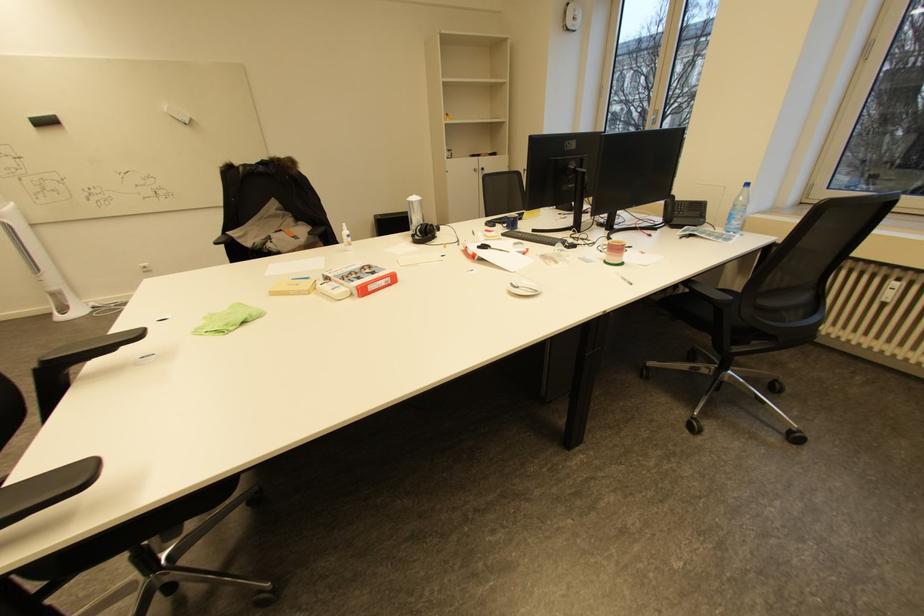
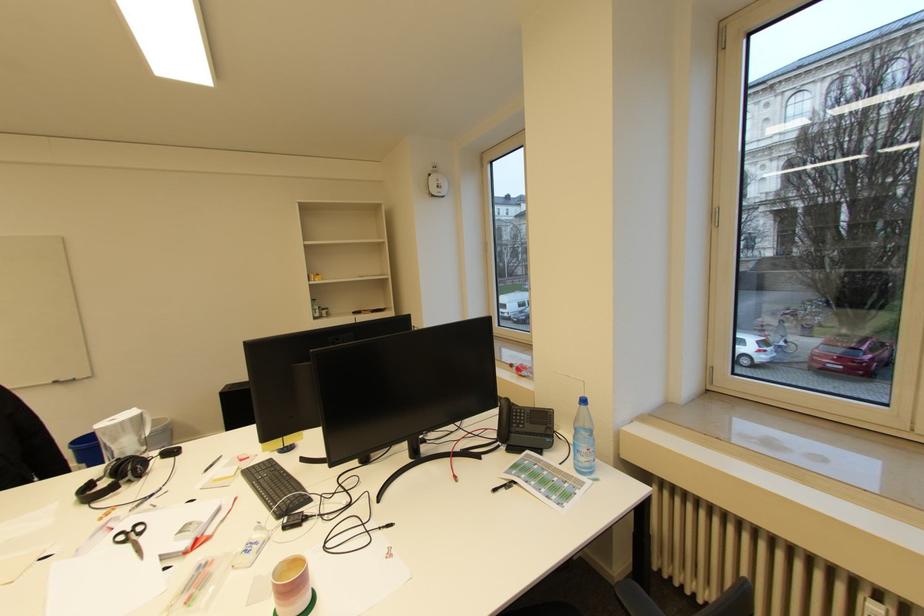
What movement of the cameraman would produce the second image?

The cameraman moved toward right, forward.